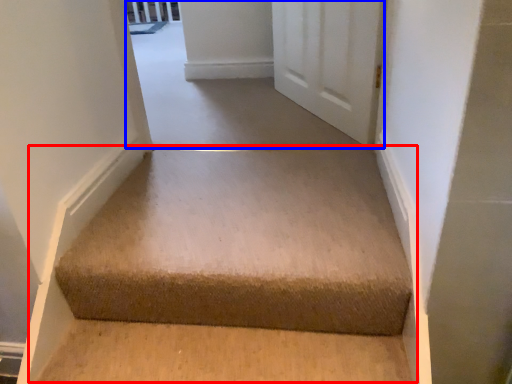
Question: Which object is further to the camera taking this photo, stairwell (highlighted by a red box) or passage (highlighted by a blue box)?

Choices:
 (A) stairwell
 (B) passage

Answer: (B)